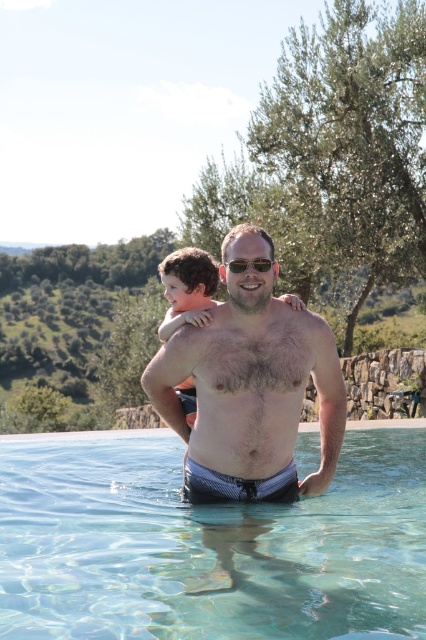
Which is below, clear glass water at center or light brown hair at upper center?

clear glass water at center is lower down.

Does clear glass water at center have a lesser height compared to light brown hair at upper center?

Yes, clear glass water at center is shorter than light brown hair at upper center.

Does point (86, 460) come behind point (175, 324)?

Yes, it is.

Locate an element on the screen. The image size is (426, 640). clear glass water at center is located at coordinates (207, 547).

Who is positioned more to the right, smooth skin man at center or curly brown hair at upper center?

smooth skin man at center

Based on the photo, does smooth skin man at center appear on the right side of curly brown hair at upper center?

Correct, you'll find smooth skin man at center to the right of curly brown hair at upper center.

Who is more distant from viewer, (267, 365) or (210, 301)?

The point (210, 301) is behind.

Identify the location of smooth skin man at center. Image resolution: width=426 pixels, height=640 pixels. (250, 387).

Describe the element at coordinates (207, 547) in the screenshot. I see `clear glass water at center` at that location.

Consider the image. Between clear glass water at center and green leafy olive tree at upper right, which one is positioned higher?

green leafy olive tree at upper right

Locate an element on the screen. The image size is (426, 640). clear glass water at center is located at coordinates (207, 547).

The image size is (426, 640). Find the location of `clear glass water at center`. clear glass water at center is located at coordinates (207, 547).